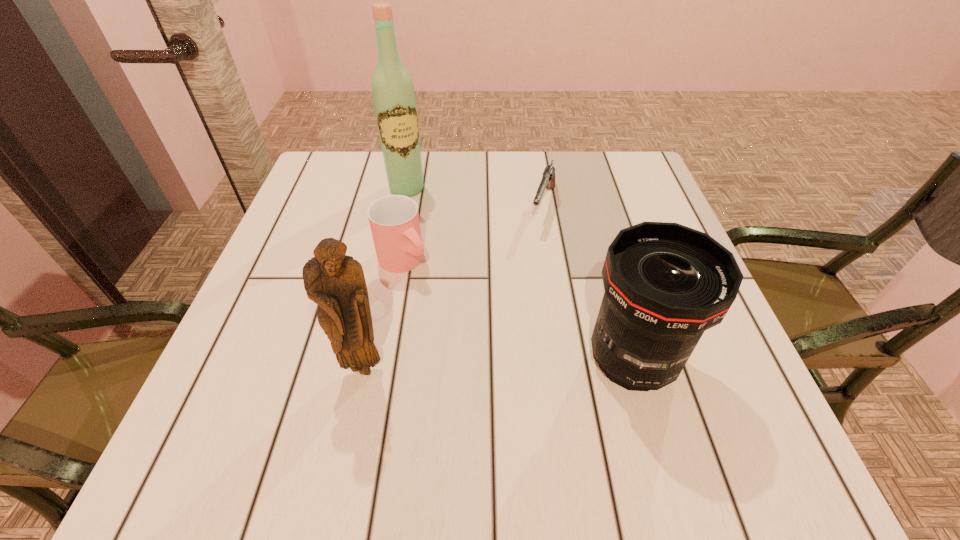
At what (x,y) coordinates should I click in order to perform the action: click on free space that satisfies the following two spatial constraints: 1. on the back side of the shortest object; 2. on the left side of the third nearest object. Please return your answer as a coordinate pair (x, y). The width and height of the screenshot is (960, 540). Looking at the image, I should click on (413, 206).

Locate an element on the screen. This screenshot has width=960, height=540. vacant space that satisfies the following two spatial constraints: 1. on the front side of the cup; 2. on the right side of the wine bottle is located at coordinates (393, 261).